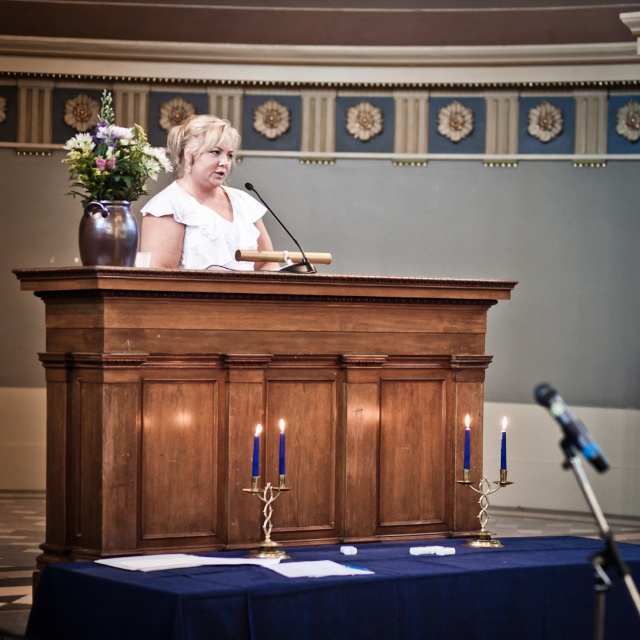
Question: Which point is closer to the camera taking this photo?

Choices:
 (A) (65, 406)
 (B) (252, 221)
 (C) (320, 600)

Answer: (C)

Question: Does black metallic microphone at lower right have a greater width compared to metallic silver microphone at center?

Choices:
 (A) no
 (B) yes

Answer: (B)

Question: Which of the following is the closest to the observer?

Choices:
 (A) (198, 618)
 (B) (292, 268)

Answer: (A)

Question: Does wooden table at center have a smaller size compared to blue fabric table at center?

Choices:
 (A) yes
 (B) no

Answer: (B)

Question: Can you confirm if wooden table at center is positioned to the right of blue fabric table at center?

Choices:
 (A) no
 (B) yes

Answer: (A)

Question: Among these points, which one is nearest to the camera?

Choices:
 (A) tap(278, 218)
 (B) tap(54, 404)
 (C) tap(208, 193)

Answer: (B)